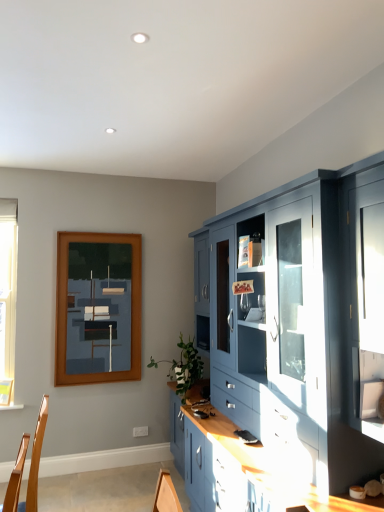
The image size is (384, 512). In order to click on free space below wooden picture frame at upper left (from a real-world perspective) in this screenshot , I will do `click(96, 471)`.